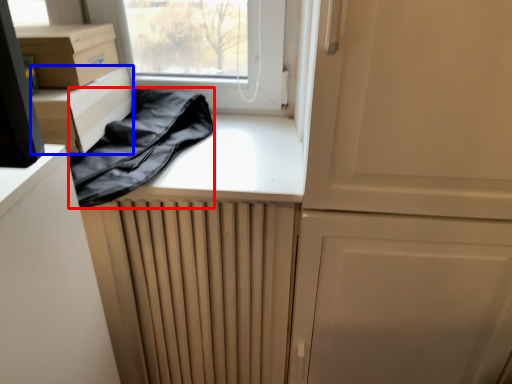
Question: Which object is further to the camera taking this photo, clothing (highlighted by a red box) or cardboard box (highlighted by a blue box)?

Choices:
 (A) clothing
 (B) cardboard box

Answer: (B)